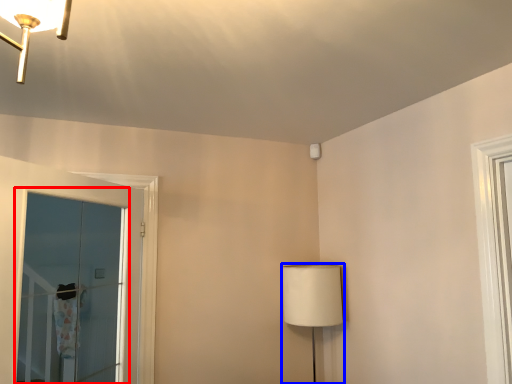
Question: Which object appears farthest to the camera in this image, window (highlighted by a red box) or table lamp (highlighted by a blue box)?

Choices:
 (A) window
 (B) table lamp

Answer: (B)